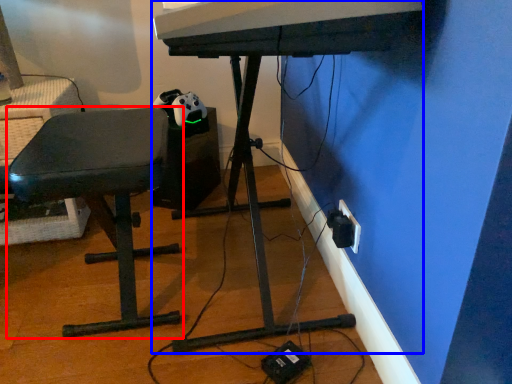
Question: Which point is further to the camera, furniture (highlighted by a red box) or computer desk (highlighted by a blue box)?

Choices:
 (A) furniture
 (B) computer desk

Answer: (A)